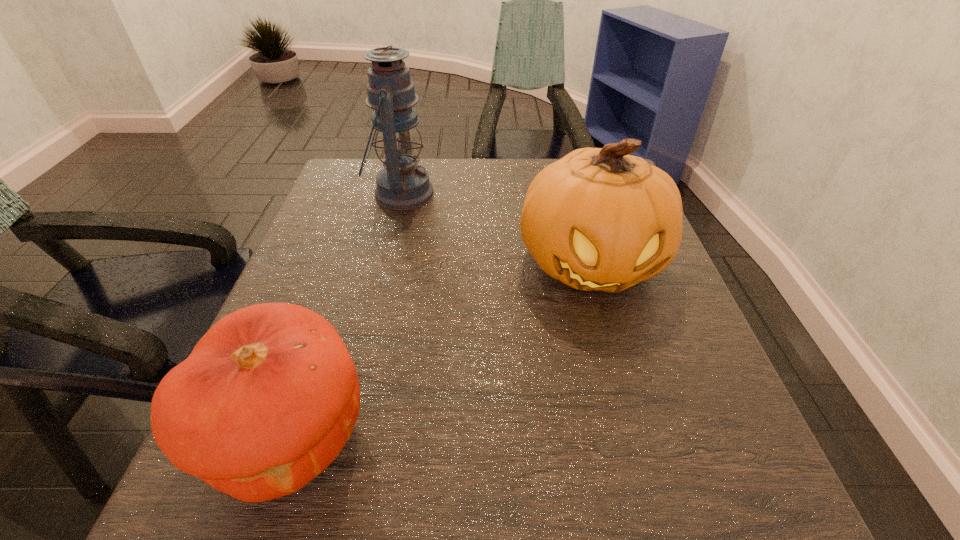
Identify the location of lantern. This screenshot has height=540, width=960. (402, 185).

At what (x,y) coordinates should I click in order to perform the action: click on the farthest object. Please return your answer as a coordinate pair (x, y). The height and width of the screenshot is (540, 960). Looking at the image, I should click on (402, 185).

The image size is (960, 540). What are the coordinates of `the second tallest object` in the screenshot? It's located at (598, 219).

You are a GUI agent. You are given a task and a screenshot of the screen. Output one action in this format:
    pyautogui.click(x=<x>, y=<y>)
    Task: Click on the right pumpkin
    This screenshot has width=960, height=540.
    Given the screenshot: What is the action you would take?
    click(x=598, y=219)

The image size is (960, 540). What are the coordinates of `the left pumpkin` in the screenshot? It's located at (269, 396).

This screenshot has height=540, width=960. What are the coordinates of `the shortest object` in the screenshot? It's located at (269, 396).

This screenshot has width=960, height=540. In order to click on vacant space located on the front-facing side of the tallest object in this screenshot , I will do `click(587, 194)`.

Where is `vacant space located 0.210m on the front face of the farther pumpkin`? vacant space located 0.210m on the front face of the farther pumpkin is located at coordinates (636, 428).

Identify the location of vacant space located 0.250m on the back of the nearer pumpkin. (348, 264).

Find the location of a particular element. The height and width of the screenshot is (540, 960). object that is at the far edge is located at coordinates (402, 185).